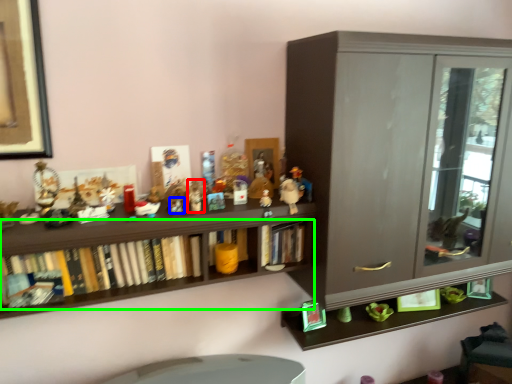
Question: Which is farther away from toy (highlighted by a red box)? toy (highlighted by a blue box) or book (highlighted by a green box)?

Choices:
 (A) toy
 (B) book

Answer: (B)